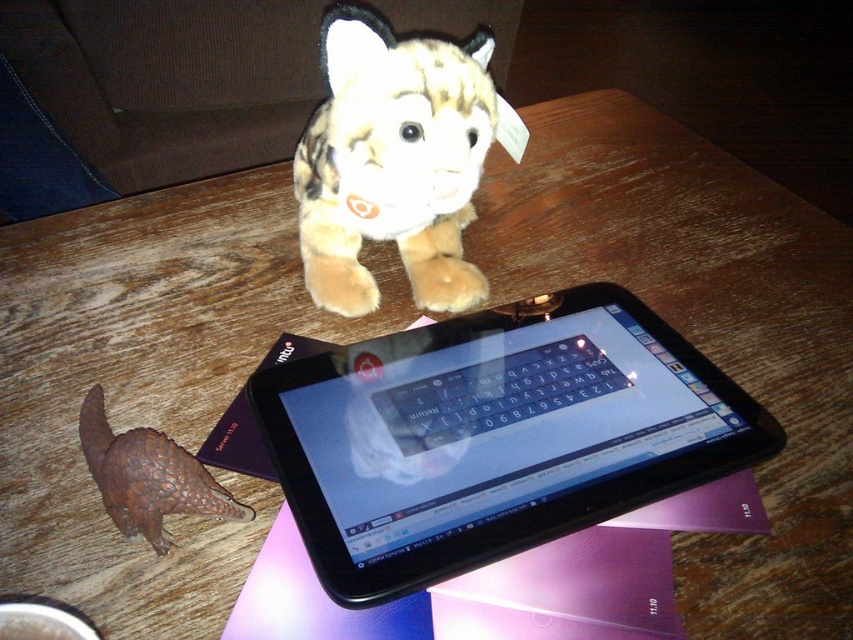
Can you confirm if black plastic tablet at upper center is positioned below bumpy brown pangolin at lower left?

No.

Does black plastic tablet at upper center have a smaller size compared to bumpy brown pangolin at lower left?

Actually, black plastic tablet at upper center might be larger than bumpy brown pangolin at lower left.

Does point (384, 420) lie in front of point (140, 442)?

That is False.

Locate an element on the screen. Image resolution: width=853 pixels, height=640 pixels. black plastic tablet at upper center is located at coordinates point(494,435).

Is fluffy brown plush toy at upper center wider than bumpy brown pangolin at lower left?

Correct, the width of fluffy brown plush toy at upper center exceeds that of bumpy brown pangolin at lower left.

Who is more distant from viewer, (473,150) or (206,508)?

The point (473,150) is more distant.

You are a GUI agent. You are given a task and a screenshot of the screen. Output one action in this format:
    pyautogui.click(x=<x>, y=<y>)
    Task: Click on the fluffy brown plush toy at upper center
    The width and height of the screenshot is (853, 640).
    Given the screenshot: What is the action you would take?
    pyautogui.click(x=393, y=161)

Which is behind, point (631, 333) or point (451, 108)?

The point (631, 333) is more distant.

Does black plastic tablet at upper center have a larger size compared to fluffy brown plush toy at upper center?

Indeed, black plastic tablet at upper center has a larger size compared to fluffy brown plush toy at upper center.

Which is behind, point (380, 410) or point (395, 154)?

The point (395, 154) is more distant.

Find the location of `black plastic tablet at upper center`. black plastic tablet at upper center is located at coordinates (494, 435).